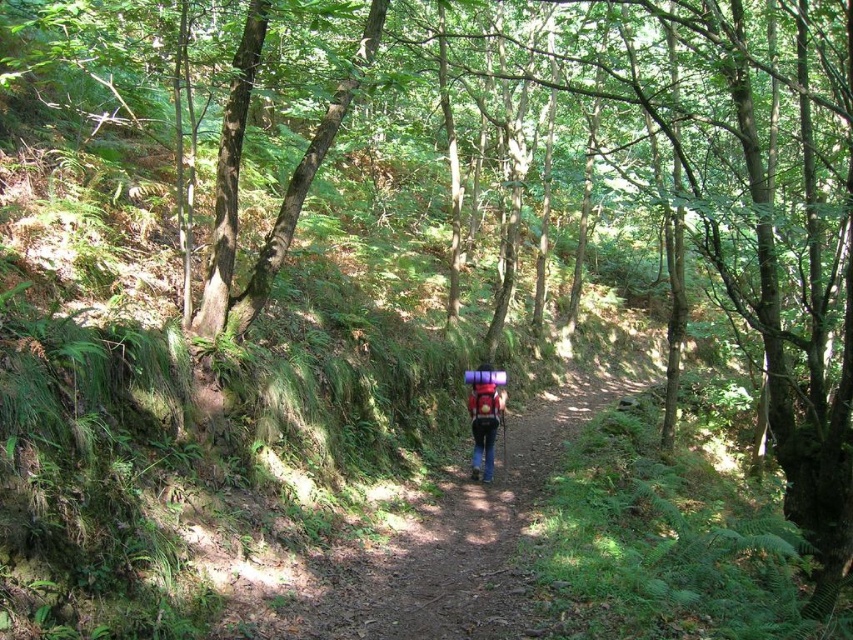
Question: Can you confirm if brown dirt path at center is positioned above matte pink backpack at center?

Choices:
 (A) yes
 (B) no

Answer: (B)

Question: Can you confirm if brown dirt path at center is smaller than matte pink backpack at center?

Choices:
 (A) no
 (B) yes

Answer: (A)

Question: Is brown dirt path at center closer to the viewer compared to matte pink backpack at center?

Choices:
 (A) no
 (B) yes

Answer: (B)

Question: Among these objects, which one is farthest from the camera?

Choices:
 (A) brown dirt path at center
 (B) matte pink backpack at center

Answer: (B)

Question: Which point is farther to the camera?

Choices:
 (A) (479, 417)
 (B) (392, 563)

Answer: (A)